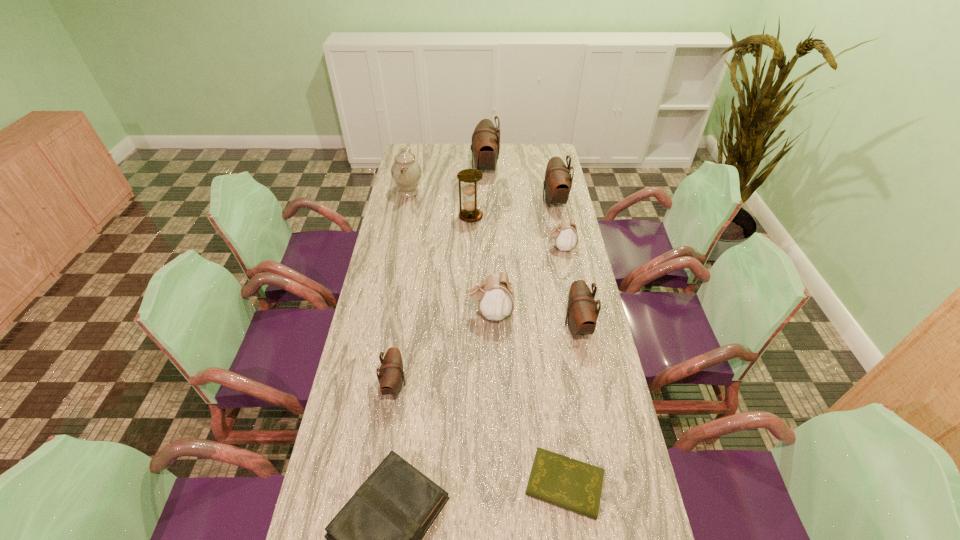
At what (x,y) coordinates should I click in order to perform the action: click on vacant space that's between the chinaware and the left white pouch. Please return your answer as a coordinate pair (x, y). Looking at the image, I should click on (449, 252).

At what (x,y) coordinates should I click in order to perform the action: click on vacant area that lies between the fourth nearest pouch and the bigger white pouch. Please return your answer as a coordinate pair (x, y). This screenshot has height=540, width=960. Looking at the image, I should click on (525, 280).

In order to click on free space between the diary and the chinaware in this screenshot , I will do `click(487, 338)`.

Where is `free space between the green diary and the brown hourglass`? free space between the green diary and the brown hourglass is located at coordinates (517, 350).

Where is `free space between the smaller white pouch and the second nearest brown pouch`? free space between the smaller white pouch and the second nearest brown pouch is located at coordinates (569, 286).

Locate an element on the screen. The width and height of the screenshot is (960, 540). free space between the brown hourglass and the third nearest object is located at coordinates (433, 300).

Where is `vacant point located between the third nearest object and the third biggest brown pouch`? Image resolution: width=960 pixels, height=540 pixels. vacant point located between the third nearest object and the third biggest brown pouch is located at coordinates (486, 355).

The height and width of the screenshot is (540, 960). What are the coordinates of `free space between the diary and the third brown pouch from right to left` in the screenshot? It's located at (525, 326).

Where is `the eighth closest object to the green diary`? the eighth closest object to the green diary is located at coordinates (406, 171).

Identify which object is the seventh closest to the shortest object. Please provide its 2D coordinates. Your answer should be formatted as a tuple, i.e. [(x, y)], where the tuple contains the x and y coordinates of a point satisfying the conditions above.

[(558, 181)]